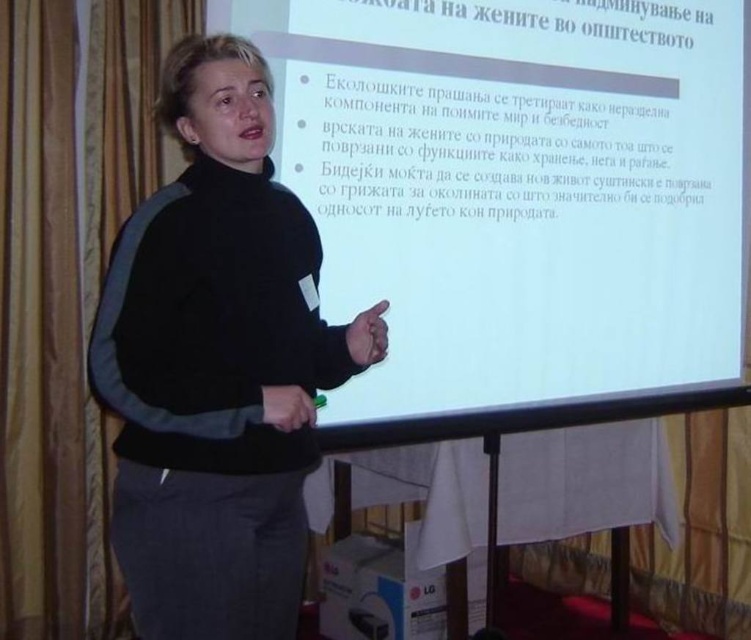
Between white matte projection screen at upper center and black fabric jacket at center, which one appears on the right side from the viewer's perspective?

Positioned to the right is white matte projection screen at upper center.

What are the coordinates of `white matte projection screen at upper center` in the screenshot? It's located at (519, 200).

The width and height of the screenshot is (751, 640). Identify the location of white matte projection screen at upper center. (519, 200).

Does white matte projection screen at upper center have a greater height compared to gold fabric curtain at left?

Incorrect, white matte projection screen at upper center's height is not larger of gold fabric curtain at left's.

Who is more distant from viewer, (703, 256) or (80, 60)?

The point (80, 60) is behind.

The width and height of the screenshot is (751, 640). What do you see at coordinates (519, 200) in the screenshot? I see `white matte projection screen at upper center` at bounding box center [519, 200].

I want to click on white matte projection screen at upper center, so click(x=519, y=200).

What do you see at coordinates (216, 364) in the screenshot? The width and height of the screenshot is (751, 640). I see `black fabric jacket at center` at bounding box center [216, 364].

Between black fabric jacket at center and gold fabric curtain at left, which one has less height?

Standing shorter between the two is black fabric jacket at center.

Image resolution: width=751 pixels, height=640 pixels. Describe the element at coordinates (216, 364) in the screenshot. I see `black fabric jacket at center` at that location.

Find the location of a particular element. The width and height of the screenshot is (751, 640). black fabric jacket at center is located at coordinates (216, 364).